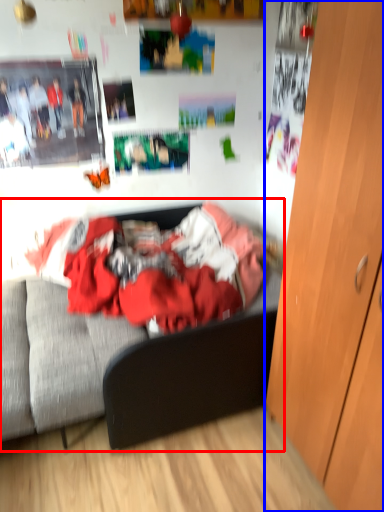
Question: Which object is further to the camera taking this photo, bed (highlighted by a red box) or cabinetry (highlighted by a blue box)?

Choices:
 (A) bed
 (B) cabinetry

Answer: (A)